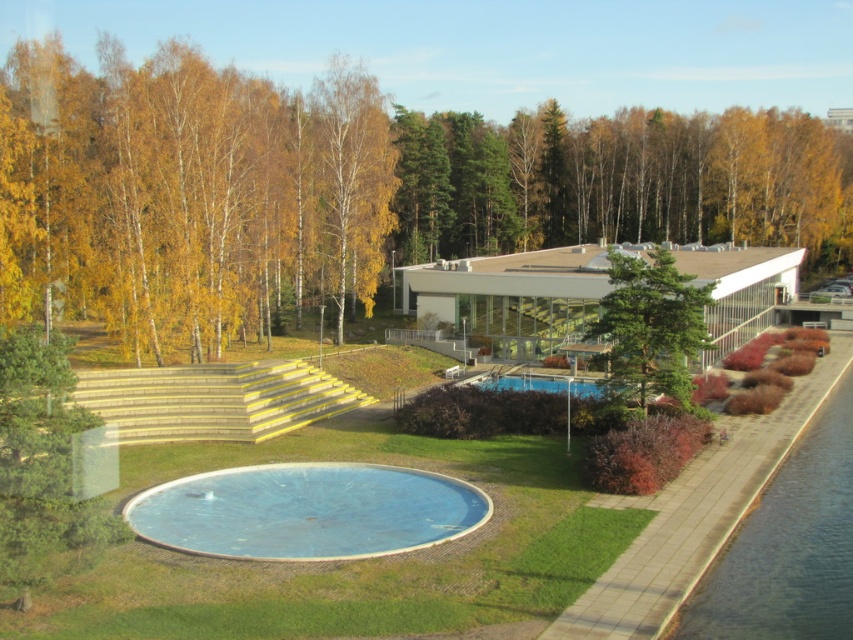
Can you confirm if green leafy tree at center is wider than yellow/golden bark at upper left?

Yes, green leafy tree at center is wider than yellow/golden bark at upper left.

Is point (96, 132) closer to camera compared to point (35, 237)?

No, (96, 132) is behind (35, 237).

Find the location of a particular element. green leafy tree at center is located at coordinates (350, 189).

Between yellow/golden bark at upper left and blue glass swimming pool at center, which one is positioned higher?

yellow/golden bark at upper left is above.

Is yellow/golden bark at upper left to the right of blue glass swimming pool at center from the viewer's perspective?

Incorrect, yellow/golden bark at upper left is not on the right side of blue glass swimming pool at center.

Is point (25, 289) closer to camera compared to point (602, 392)?

No, it is behind (602, 392).

Where is `yellow/golden bark at upper left`? yellow/golden bark at upper left is located at coordinates (186, 193).

Is yellow/golden bark at upper left to the left of green textured tree at center from the viewer's perspective?

Yes, yellow/golden bark at upper left is to the left of green textured tree at center.

Between yellow/golden bark at upper left and green textured tree at center, which one has more height?

With more height is yellow/golden bark at upper left.

At what (x,y) coordinates should I click in order to perform the action: click on yellow/golden bark at upper left. Please return your answer as a coordinate pair (x, y). The width and height of the screenshot is (853, 640). Looking at the image, I should click on (186, 193).